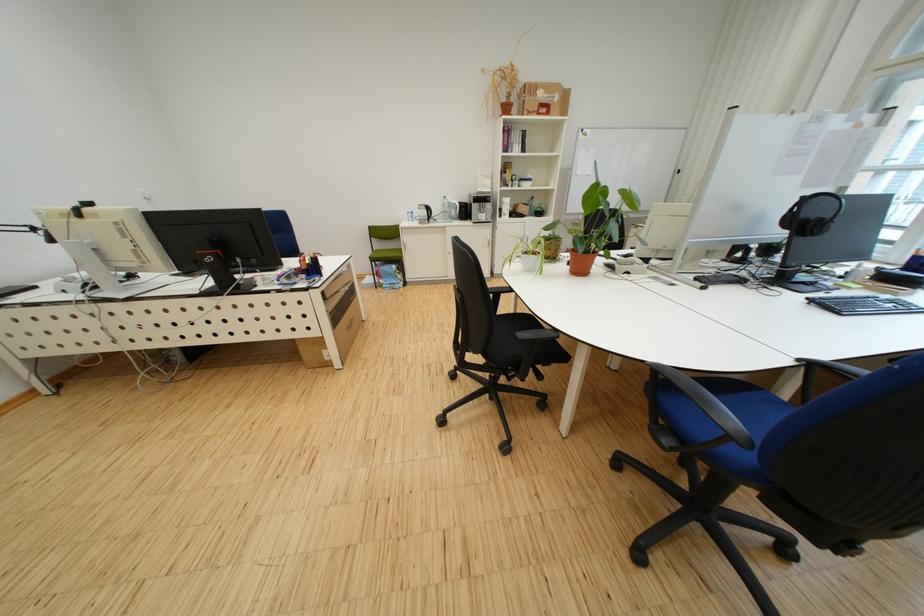
Find where to lift the terracotta plant pot. Please return your answer as a coordinate pair (x, y).

(580, 262)